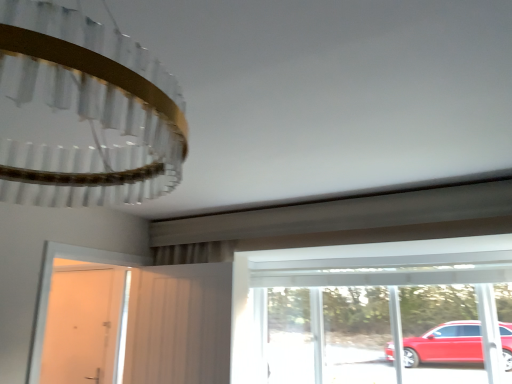
Question: Is transparent glass window at center positioned with its back to white matte door at left, placed as the 2th door when sorted from left to right?

Choices:
 (A) no
 (B) yes

Answer: (A)

Question: Is transparent glass window at center aimed at white matte door at left, the 1th door when ordered from right to left?

Choices:
 (A) yes
 (B) no

Answer: (A)

Question: Would you say transparent glass window at center contains white matte door at left, placed as the 2th door when sorted from left to right?

Choices:
 (A) no
 (B) yes

Answer: (A)

Question: From the image's perspective, is transparent glass window at center beneath white matte door at left, arranged as the first door when viewed from the front?

Choices:
 (A) yes
 (B) no

Answer: (A)

Question: From a real-world perspective, does transparent glass window at center sit lower than white matte door at left, the 1th door when ordered from right to left?

Choices:
 (A) no
 (B) yes

Answer: (B)

Question: Is transparent glass window at center closer to camera compared to white matte door at left, the second door from the back?

Choices:
 (A) yes
 (B) no

Answer: (B)

Question: Can you confirm if white fabric screen door at center is bigger than white matte door at left, placed as the 2th door when sorted from left to right?

Choices:
 (A) yes
 (B) no

Answer: (B)

Question: Can white matte door at left, placed as the 2th door when sorted from left to right, be found inside white fabric screen door at center?

Choices:
 (A) yes
 (B) no

Answer: (B)

Question: Is white fabric screen door at center facing away from white matte door at left, the 1th door when ordered from right to left?

Choices:
 (A) yes
 (B) no

Answer: (B)

Question: Does white fabric screen door at center lie behind white matte door at left, the second door from the back?

Choices:
 (A) yes
 (B) no

Answer: (A)

Question: Can we say white fabric screen door at center lies outside white matte door at left, the 1th door when ordered from right to left?

Choices:
 (A) yes
 (B) no

Answer: (A)

Question: Considering the relative positions of white fabric screen door at center and white matte door at left, arranged as the first door when viewed from the front, in the image provided, is white fabric screen door at center to the left of white matte door at left, arranged as the first door when viewed from the front, from the viewer's perspective?

Choices:
 (A) yes
 (B) no

Answer: (B)

Question: From the image's perspective, is white glossy door at left, which is the 2th door in right-to-left order, on top of white fabric screen door at center?

Choices:
 (A) no
 (B) yes

Answer: (A)